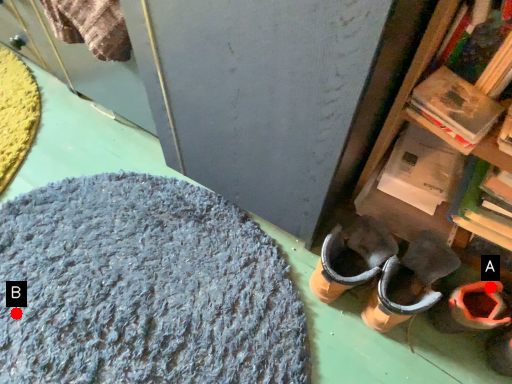
Question: Two points are circled on the image, labeled by A and B beside each circle. Which point is closer to the camera taking this photo?

Choices:
 (A) A is closer
 (B) B is closer

Answer: (A)